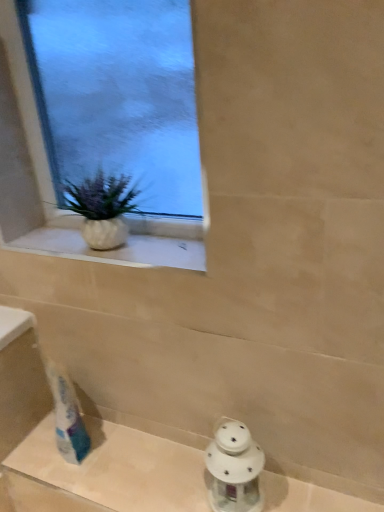
Question: From the image's perspective, is white glass lantern at lower center located above or below white textured vase at upper left?

Choices:
 (A) above
 (B) below

Answer: (B)

Question: Does point (167, 481) appear closer or farther from the camera than point (99, 216)?

Choices:
 (A) closer
 (B) farther

Answer: (B)

Question: Estimate the real-world distances between objects in this image. Which object is farther from the white textured vase at upper left?

Choices:
 (A) white glass lantern at lower center
 (B) clear glass window at upper left
 (C) white porcelain lantern at lower right

Answer: (A)

Question: Estimate the real-world distances between objects in this image. Which object is closer to the white textured vase at upper left?

Choices:
 (A) white glass lantern at lower center
 (B) white porcelain lantern at lower right
 (C) clear glass window at upper left

Answer: (C)